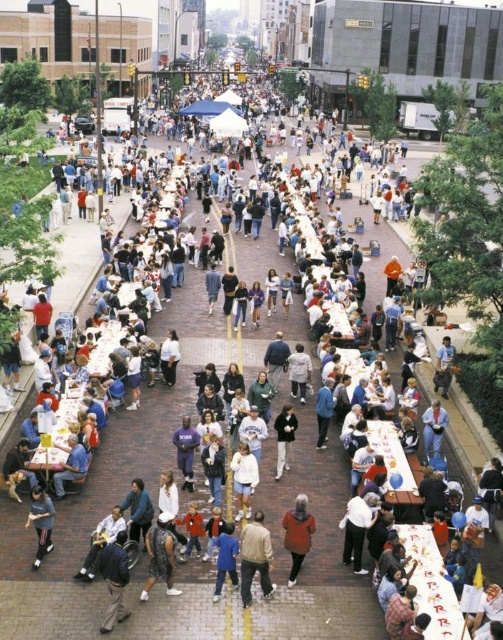
You are a photographer standing at the edge of the crowd, wanting to capture both the white matte shorts at center and the dark gray sweater at center in a single photo. Given that your camera has a maximum focus range of 2 meters, will you be able to include both subjects in the shot without moving closer?

The distance between the white matte shorts at center and the dark gray sweater at center is 2.10 meters. Since the camera can only focus up to 2 meters, the subjects are slightly out of range. You might need to adjust your position or use a different camera setting to ensure both are in focus.

You are a photographer standing at the edge of the event area. You want to take a photo that includes both the patterned fabric dress at center and the orange fleece jacket at center. Which one should you adjust your position to ensure the other is visible if they are currently blocking each other?

The patterned fabric dress at center is in front of the orange fleece jacket at center. To ensure both are visible, you should move your position so that the patterned fabric dress at center is no longer blocking the orange fleece jacket at center.

You are a photographer standing at the edge of the crowd. You want to take a photo that includes both the orange fleece jacket at center and the dark gray sweatshirt at lower left. Which of these two items should you adjust your camera angle to focus on to ensure both are visible in the frame?

Since the orange fleece jacket at center is much taller than the dark gray sweatshirt at lower left, you should focus on the orange fleece jacket at center to ensure both are visible in the frame.